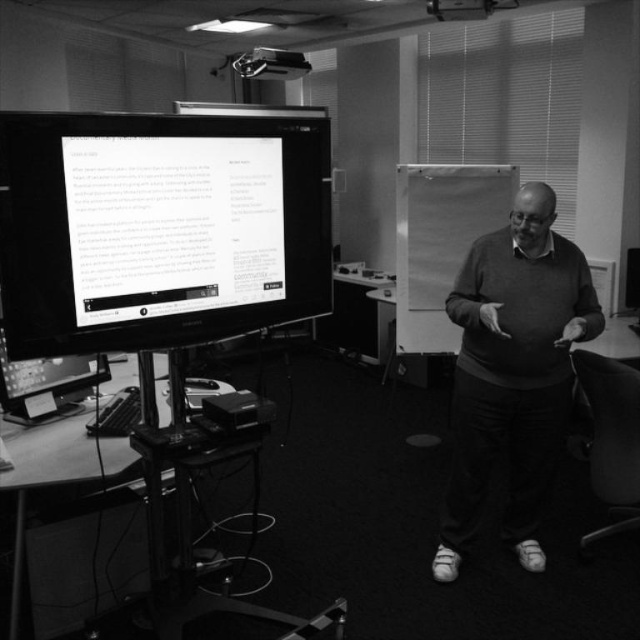
You are organizing a classroom cleanup and need to place a smooth plastic swivel chair at lower right on top of the matte sweater at center. Will the sweater be large enough to cover the chair?

The matte sweater at center has a larger width than the smooth plastic swivel chair at lower right, so the sweater should be large enough to cover the chair.